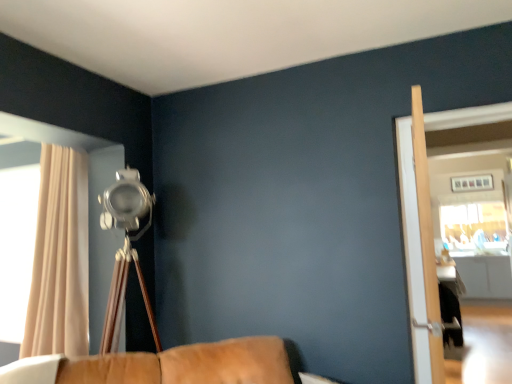
Identify the location of beige fabric curtain at left. (60, 258).

What do you see at coordinates (60, 258) in the screenshot? I see `beige fabric curtain at left` at bounding box center [60, 258].

The height and width of the screenshot is (384, 512). What do you see at coordinates (420, 242) in the screenshot?
I see `light wood screen door at right, the 1th screen door when ordered from left to right` at bounding box center [420, 242].

Where is `clear glass screen door at right, arranged as the 1th screen door when viewed from the right`? clear glass screen door at right, arranged as the 1th screen door when viewed from the right is located at coordinates (411, 222).

Where is `beige fabric curtain at left`? This screenshot has height=384, width=512. beige fabric curtain at left is located at coordinates (60, 258).

From a real-world perspective, is clear glass screen door at right, which is counted as the second screen door, starting from the left, on beige fabric curtain at left?

Actually, clear glass screen door at right, which is counted as the second screen door, starting from the left, is physically below beige fabric curtain at left in the real world.

From the image's perspective, is clear glass screen door at right, which is counted as the second screen door, starting from the left, above or below beige fabric curtain at left?

clear glass screen door at right, which is counted as the second screen door, starting from the left, is above beige fabric curtain at left.

Who is shorter, clear glass screen door at right, arranged as the 1th screen door when viewed from the right, or beige fabric curtain at left?

Standing shorter between the two is clear glass screen door at right, arranged as the 1th screen door when viewed from the right.

Identify the location of curtain behind the clear glass screen door at right, arranged as the 1th screen door when viewed from the right. (60, 258).

Between light wood screen door at right, which is the second screen door from right to left, and clear glass screen door at right, which is counted as the second screen door, starting from the left, which one has less height?

light wood screen door at right, which is the second screen door from right to left.

Is light wood screen door at right, the 1th screen door when ordered from left to right, bigger than clear glass screen door at right, arranged as the 1th screen door when viewed from the right?

Indeed, light wood screen door at right, the 1th screen door when ordered from left to right, has a larger size compared to clear glass screen door at right, arranged as the 1th screen door when viewed from the right.

Is light wood screen door at right, which is the second screen door from right to left, turned away from clear glass screen door at right, which is counted as the second screen door, starting from the left?

light wood screen door at right, which is the second screen door from right to left, is not turned away from clear glass screen door at right, which is counted as the second screen door, starting from the left.

Measure the distance between light wood screen door at right, which is the second screen door from right to left, and clear glass screen door at right, which is counted as the second screen door, starting from the left.

light wood screen door at right, which is the second screen door from right to left, is 31.05 centimeters away from clear glass screen door at right, which is counted as the second screen door, starting from the left.

Does clear glass screen door at right, which is counted as the second screen door, starting from the left, have a lesser height compared to light wood screen door at right, the 1th screen door when ordered from left to right?

In fact, clear glass screen door at right, which is counted as the second screen door, starting from the left, may be taller than light wood screen door at right, the 1th screen door when ordered from left to right.

Locate an element on the screen. Image resolution: width=512 pixels, height=384 pixels. screen door behind the light wood screen door at right, the 1th screen door when ordered from left to right is located at coordinates (411, 222).

Can you tell me how much clear glass screen door at right, which is counted as the second screen door, starting from the left, and light wood screen door at right, which is the second screen door from right to left, differ in facing direction?

The angular difference between clear glass screen door at right, which is counted as the second screen door, starting from the left, and light wood screen door at right, which is the second screen door from right to left, is 97.7 degrees.

Which is nearer, (466,124) or (409,133)?

The point (409,133) is closer.

Looking at this image, is light wood screen door at right, which is the second screen door from right to left, spatially inside brown leather couch at lower center, or outside of it?

The correct answer is: outside.

Between light wood screen door at right, the 1th screen door when ordered from left to right, and brown leather couch at lower center, which one has less height?

brown leather couch at lower center is shorter.

In the scene shown: Considering the relative sizes of light wood screen door at right, the 1th screen door when ordered from left to right, and brown leather couch at lower center in the image provided, is light wood screen door at right, the 1th screen door when ordered from left to right, bigger than brown leather couch at lower center?

No, light wood screen door at right, the 1th screen door when ordered from left to right, is not bigger than brown leather couch at lower center.

Would you consider light wood screen door at right, the 1th screen door when ordered from left to right, to be distant from brown leather couch at lower center?

Indeed, light wood screen door at right, the 1th screen door when ordered from left to right, is not near brown leather couch at lower center.

Is beige fabric curtain at left turned away from brown leather couch at lower center?

No, beige fabric curtain at left's orientation is not away from brown leather couch at lower center.

Does beige fabric curtain at left have a lesser height compared to brown leather couch at lower center?

Incorrect, the height of beige fabric curtain at left does not fall short of that of brown leather couch at lower center.

Is beige fabric curtain at left touching brown leather couch at lower center?

No, beige fabric curtain at left is not with brown leather couch at lower center.

Does beige fabric curtain at left appear on the left side of brown leather couch at lower center?

Yes, beige fabric curtain at left is to the left of brown leather couch at lower center.

Considering the relative sizes of beige fabric curtain at left and clear glass screen door at right, which is counted as the second screen door, starting from the left, in the image provided, is beige fabric curtain at left taller than clear glass screen door at right, which is counted as the second screen door, starting from the left,?

Correct, beige fabric curtain at left is much taller as clear glass screen door at right, which is counted as the second screen door, starting from the left.

Is beige fabric curtain at left further to camera compared to clear glass screen door at right, arranged as the 1th screen door when viewed from the right?

That is True.

Is beige fabric curtain at left at the right side of clear glass screen door at right, arranged as the 1th screen door when viewed from the right?

In fact, beige fabric curtain at left is to the left of clear glass screen door at right, arranged as the 1th screen door when viewed from the right.

Is point (412, 166) farther from camera compared to point (213, 349)?

No.

How distant is clear glass screen door at right, arranged as the 1th screen door when viewed from the right, from brown leather couch at lower center?

They are 1.33 meters apart.

Is clear glass screen door at right, arranged as the 1th screen door when viewed from the right, in front of or behind brown leather couch at lower center in the image?

clear glass screen door at right, arranged as the 1th screen door when viewed from the right, is positioned farther from the viewer than brown leather couch at lower center.

Can you confirm if clear glass screen door at right, arranged as the 1th screen door when viewed from the right, is shorter than brown leather couch at lower center?

Incorrect, the height of clear glass screen door at right, arranged as the 1th screen door when viewed from the right, does not fall short of that of brown leather couch at lower center.

The height and width of the screenshot is (384, 512). What are the coordinates of `curtain above the clear glass screen door at right, arranged as the 1th screen door when viewed from the right (from a real-world perspective)` in the screenshot? It's located at (60, 258).

The image size is (512, 384). What are the coordinates of `screen door located underneath the clear glass screen door at right, which is counted as the second screen door, starting from the left (from a real-world perspective)` in the screenshot? It's located at (420, 242).

Looking at the image, which one is located closer to beige fabric curtain at left, light wood screen door at right, the 1th screen door when ordered from left to right, or brown leather couch at lower center?

brown leather couch at lower center.

Which object lies further to the anchor point clear glass screen door at right, which is counted as the second screen door, starting from the left, light wood screen door at right, which is the second screen door from right to left, or beige fabric curtain at left?

beige fabric curtain at left is further to clear glass screen door at right, which is counted as the second screen door, starting from the left.

Based on their spatial positions, is clear glass screen door at right, arranged as the 1th screen door when viewed from the right, or brown leather couch at lower center closer to light wood screen door at right, which is the second screen door from right to left?

The object closer to light wood screen door at right, which is the second screen door from right to left, is clear glass screen door at right, arranged as the 1th screen door when viewed from the right.

Based on their spatial positions, is light wood screen door at right, which is the second screen door from right to left, or clear glass screen door at right, which is counted as the second screen door, starting from the left, further from brown leather couch at lower center?

clear glass screen door at right, which is counted as the second screen door, starting from the left.

Considering their positions, is beige fabric curtain at left positioned further to brown leather couch at lower center than clear glass screen door at right, which is counted as the second screen door, starting from the left?

The object further to brown leather couch at lower center is clear glass screen door at right, which is counted as the second screen door, starting from the left.

From the image, which object appears to be farther from clear glass screen door at right, which is counted as the second screen door, starting from the left, light wood screen door at right, the 1th screen door when ordered from left to right, or brown leather couch at lower center?

The object further to clear glass screen door at right, which is counted as the second screen door, starting from the left, is brown leather couch at lower center.

Considering their positions, is brown leather couch at lower center positioned closer to light wood screen door at right, the 1th screen door when ordered from left to right, than beige fabric curtain at left?

The object closer to light wood screen door at right, the 1th screen door when ordered from left to right, is brown leather couch at lower center.

Based on their spatial positions, is beige fabric curtain at left or brown leather couch at lower center closer to light wood screen door at right, the 1th screen door when ordered from left to right?

Based on the image, brown leather couch at lower center appears to be nearer to light wood screen door at right, the 1th screen door when ordered from left to right.

This screenshot has width=512, height=384. In order to click on furniture between beige fabric curtain at left and clear glass screen door at right, arranged as the 1th screen door when viewed from the right, in the horizontal direction in this screenshot , I will do `click(198, 364)`.

Where is `screen door situated between brown leather couch at lower center and clear glass screen door at right, arranged as the 1th screen door when viewed from the right, from left to right`? The height and width of the screenshot is (384, 512). screen door situated between brown leather couch at lower center and clear glass screen door at right, arranged as the 1th screen door when viewed from the right, from left to right is located at coordinates (420, 242).

Where is `screen door between beige fabric curtain at left and clear glass screen door at right, which is counted as the second screen door, starting from the left, in the horizontal direction`? Image resolution: width=512 pixels, height=384 pixels. screen door between beige fabric curtain at left and clear glass screen door at right, which is counted as the second screen door, starting from the left, in the horizontal direction is located at coordinates (420, 242).

Locate an element on the screen. furniture between beige fabric curtain at left and light wood screen door at right, which is the second screen door from right to left, in the horizontal direction is located at coordinates (198, 364).